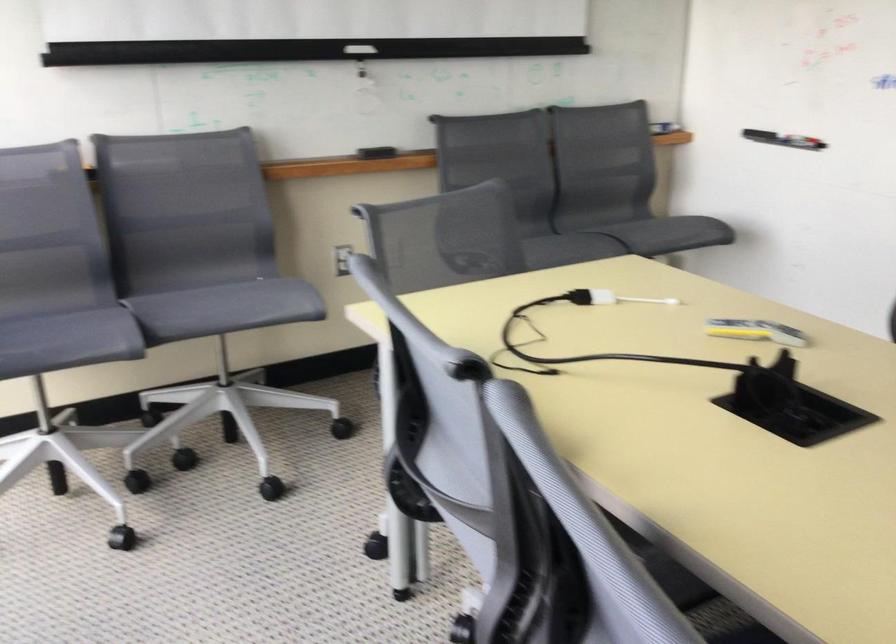
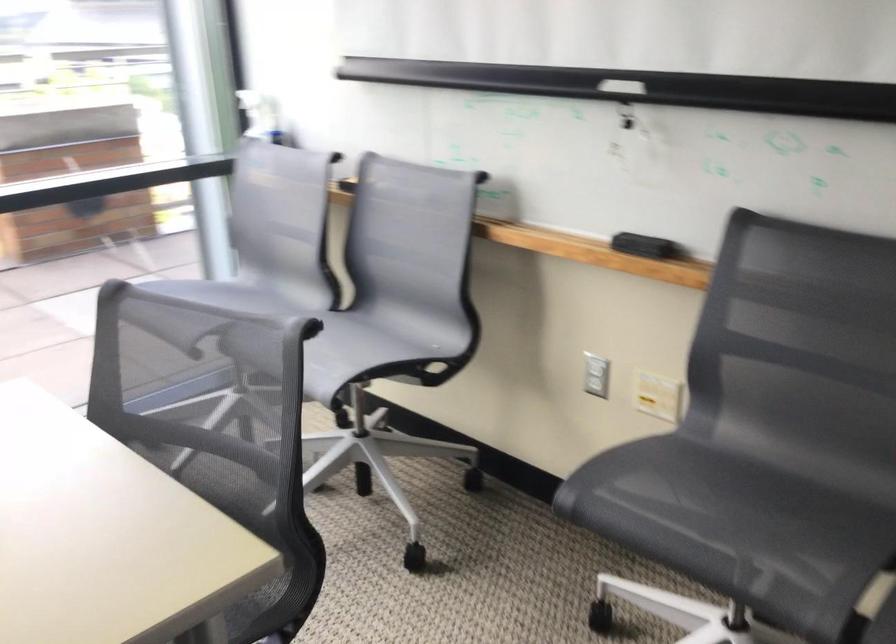
Locate, in the second image, the point that corresponds to (538,240) in the first image.

(752, 506)